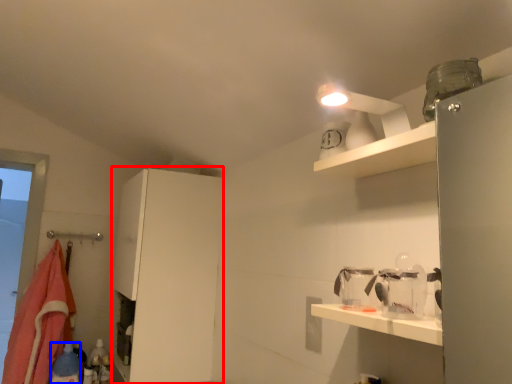
Question: Which point is closer to the camera, cabinetry (highlighted by a red box) or bottle (highlighted by a blue box)?

Choices:
 (A) cabinetry
 (B) bottle

Answer: (A)